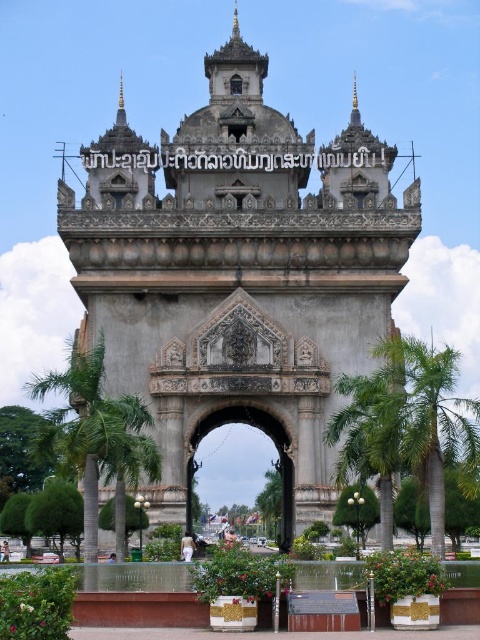
Question: Among these points, which one is nearest to the camera?

Choices:
 (A) [187, 490]
 (B) [162, 252]
 (C) [92, 509]

Answer: (C)

Question: Is gray stone archway at center further to camera compared to green leafy palm tree at left?

Choices:
 (A) no
 (B) yes

Answer: (B)

Question: Can you confirm if gray stone archway at center is smaller than carved stone archway at center?

Choices:
 (A) no
 (B) yes

Answer: (A)

Question: In this image, where is gray stone archway at center located relative to green leafy palm tree at center?

Choices:
 (A) above
 (B) below

Answer: (A)

Question: Considering the real-world distances, which object is farthest from the green leafy palm tree at center?

Choices:
 (A) gray stone archway at center
 (B) green leafy palm tree at left
 (C) carved stone archway at center

Answer: (B)

Question: Which point is farther to the camera?

Choices:
 (A) (86, 451)
 (B) (107, 356)

Answer: (B)